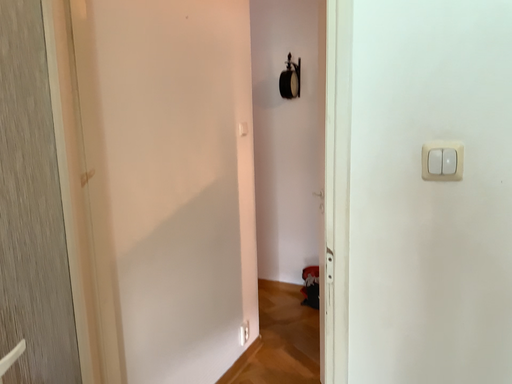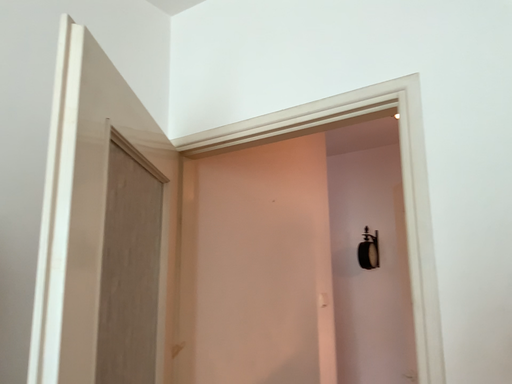
Question: Which way did the camera rotate in the video?

Choices:
 (A) rotated right
 (B) rotated left

Answer: (B)